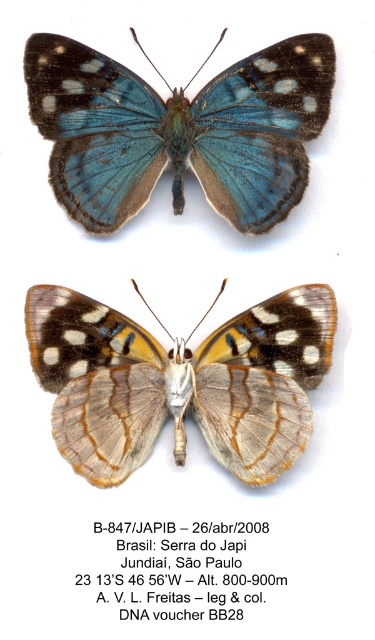
Does blue iridescent wings at center have a greater height compared to translucent silver butterfly at center?

In fact, blue iridescent wings at center may be shorter than translucent silver butterfly at center.

What do you see at coordinates (180, 131) in the screenshot? The image size is (375, 640). I see `blue iridescent wings at center` at bounding box center [180, 131].

Locate an element on the screen. Image resolution: width=375 pixels, height=640 pixels. blue iridescent wings at center is located at coordinates (180, 131).